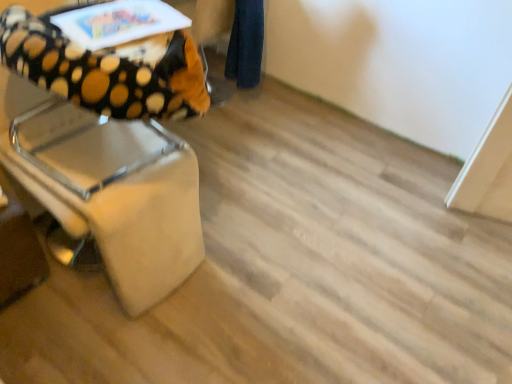
Find the location of `free spot above beige leather chair at left (from a real-world perspective)`. free spot above beige leather chair at left (from a real-world perspective) is located at coordinates (85, 14).